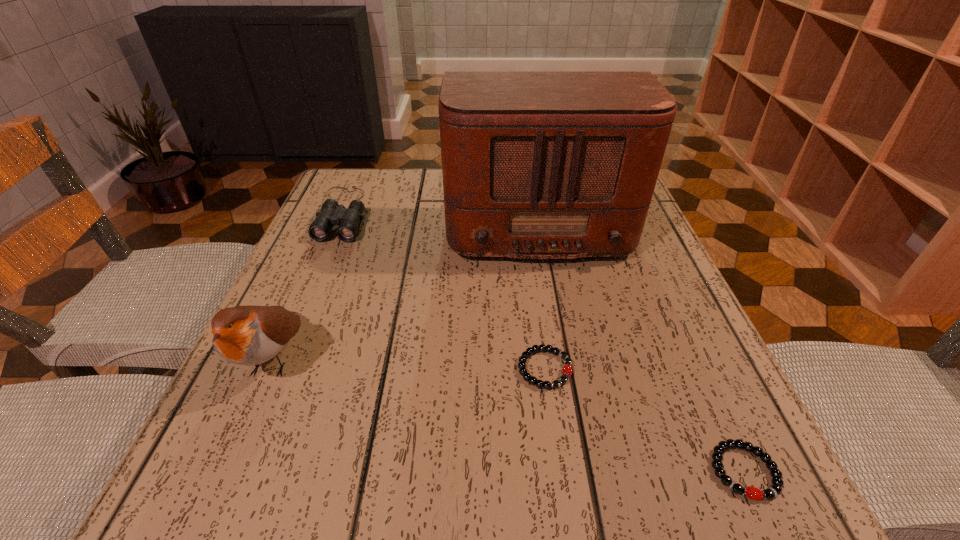
At what (x,y) coordinates should I click in order to perform the action: click on free spot that satisfies the following two spatial constraints: 1. at the eyepiece of the left bracelet; 2. on the left side of the third shortest object. Please return your answer as a coordinate pair (x, y). This screenshot has width=960, height=540. Looking at the image, I should click on (277, 369).

I want to click on free space that satisfies the following two spatial constraints: 1. at the eyepiece of the left bracelet; 2. on the left side of the third tallest object, so click(277, 369).

Locate an element on the screen. This screenshot has width=960, height=540. free location that satisfies the following two spatial constraints: 1. at the eyepiece of the binoculars; 2. on the left side of the nearest object is located at coordinates (234, 471).